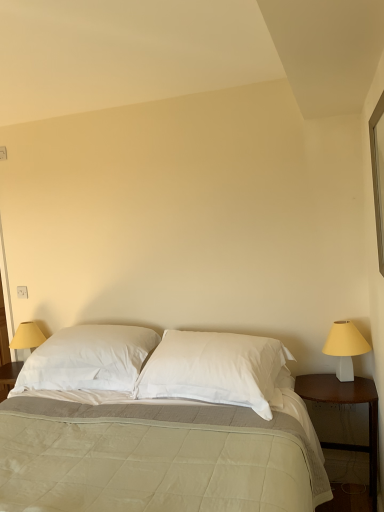
You are a GUI agent. You are given a task and a screenshot of the screen. Output one action in this format:
    pyautogui.click(x=<x>, y=<y>)
    Task: Click on the free space above wooden nightstand at right (from a real-world perspective)
    The height and width of the screenshot is (512, 384).
    Given the screenshot: What is the action you would take?
    pyautogui.click(x=344, y=384)